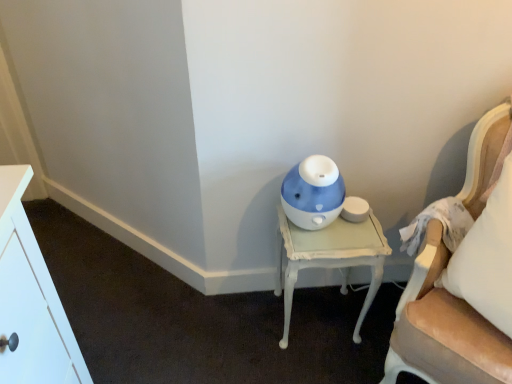
Where is `free space above white painted wood nightstand at lower right (from a real-world perspective)`? The image size is (512, 384). free space above white painted wood nightstand at lower right (from a real-world perspective) is located at coordinates (333, 232).